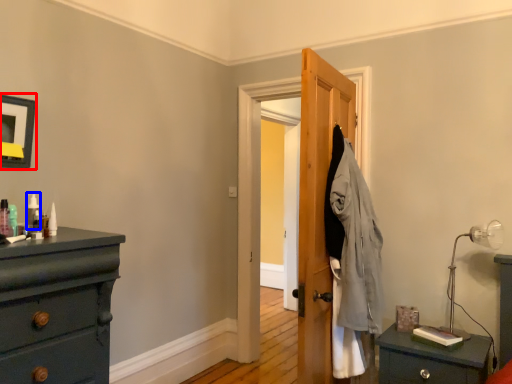
Question: Among these objects, which one is nearest to the camera, picture frame (highlighted by a red box) or toiletry (highlighted by a blue box)?

Choices:
 (A) picture frame
 (B) toiletry

Answer: (A)